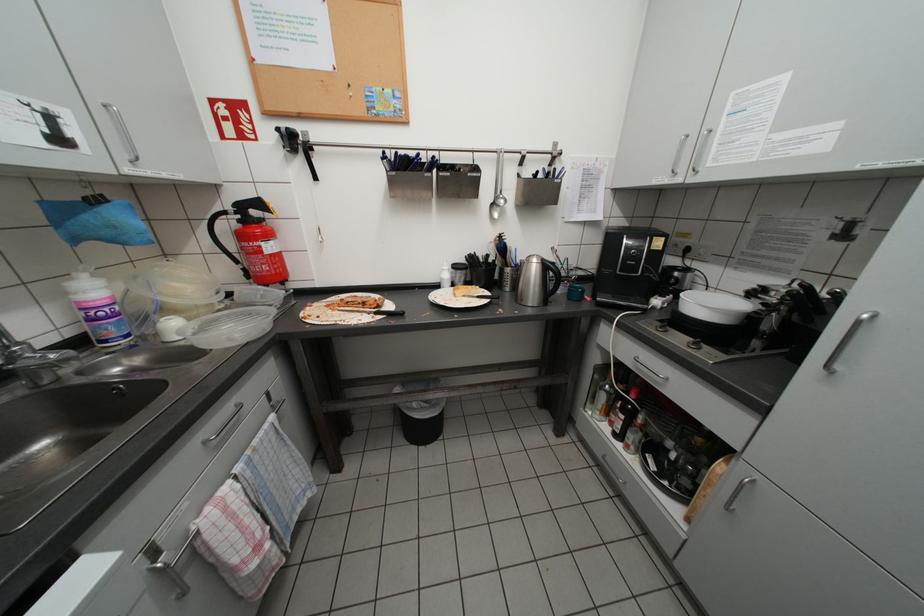
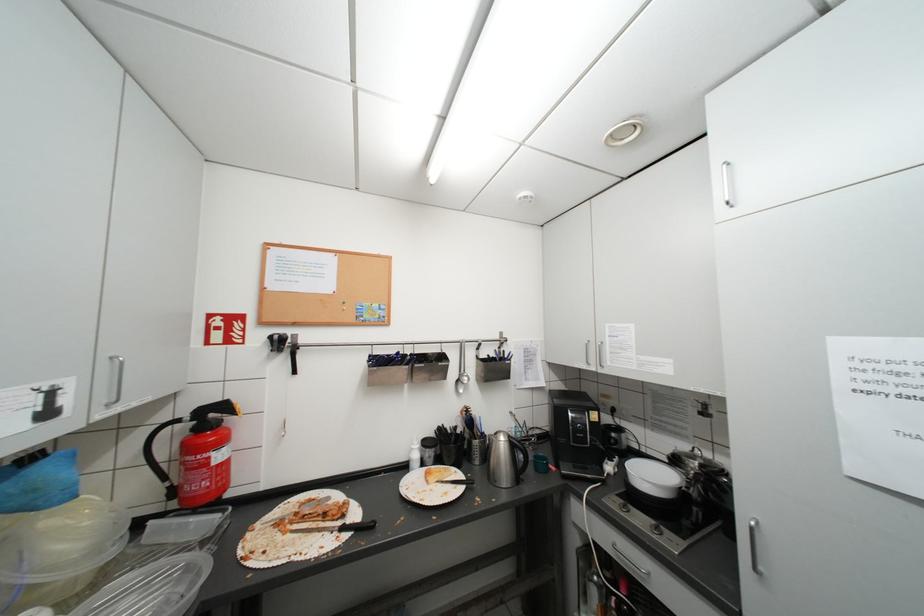
Question: The first image is from the beginning of the video and the second image is from the end. How did the camera likely rotate when shooting the video?

Choices:
 (A) Left
 (B) Right
 (C) Up
 (D) Down

Answer: (C)